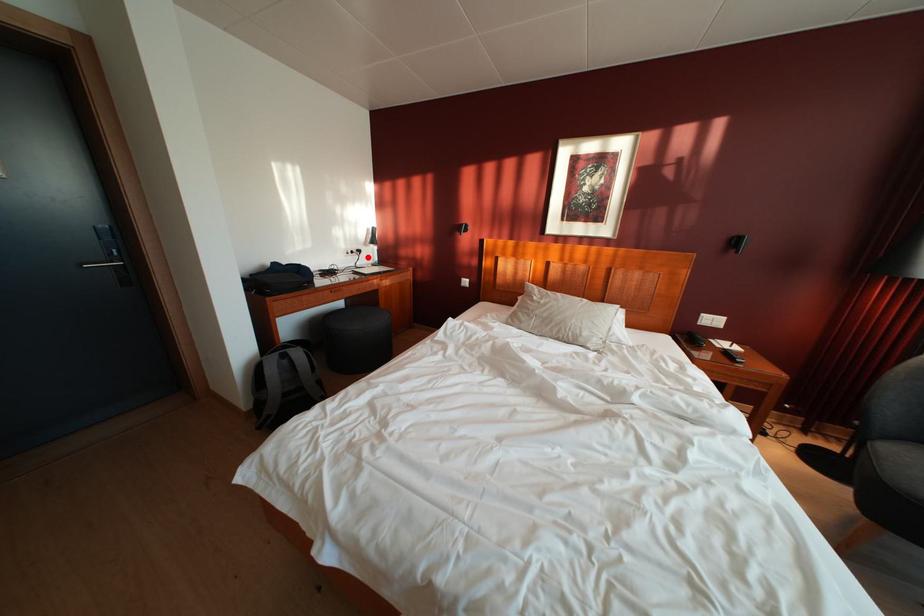
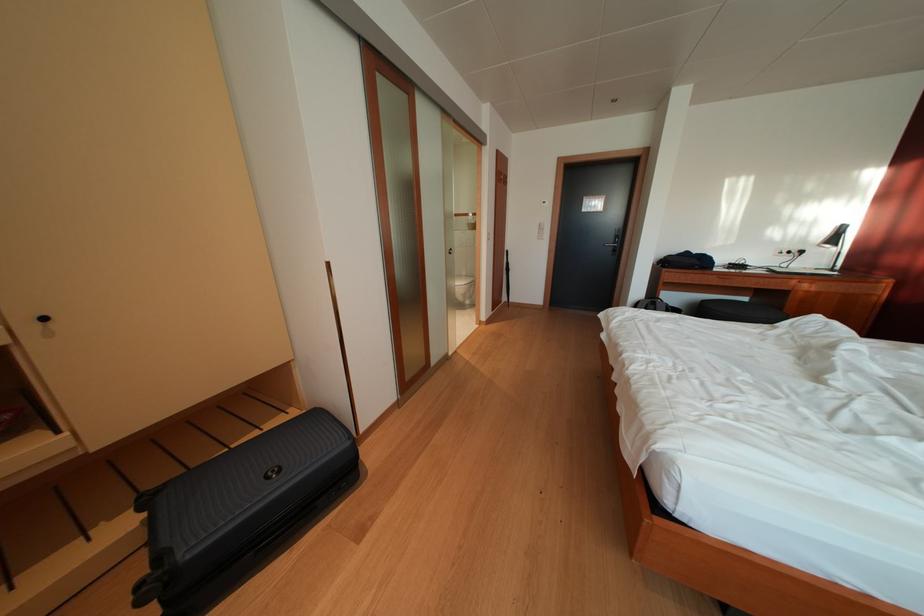
Question: I am providing you with two images of the same scene from different viewpoints. Image1 has a red point marked. In image2, the corresponding 3D location appears at what relative position? Reply with the corresponding letter.

Choices:
 (A) Closer
 (B) Farther

Answer: (B)